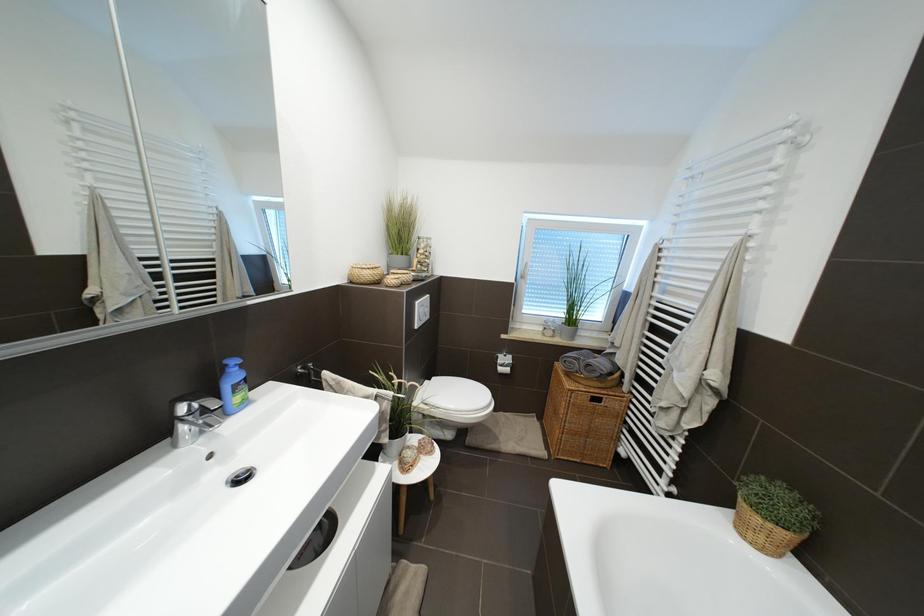
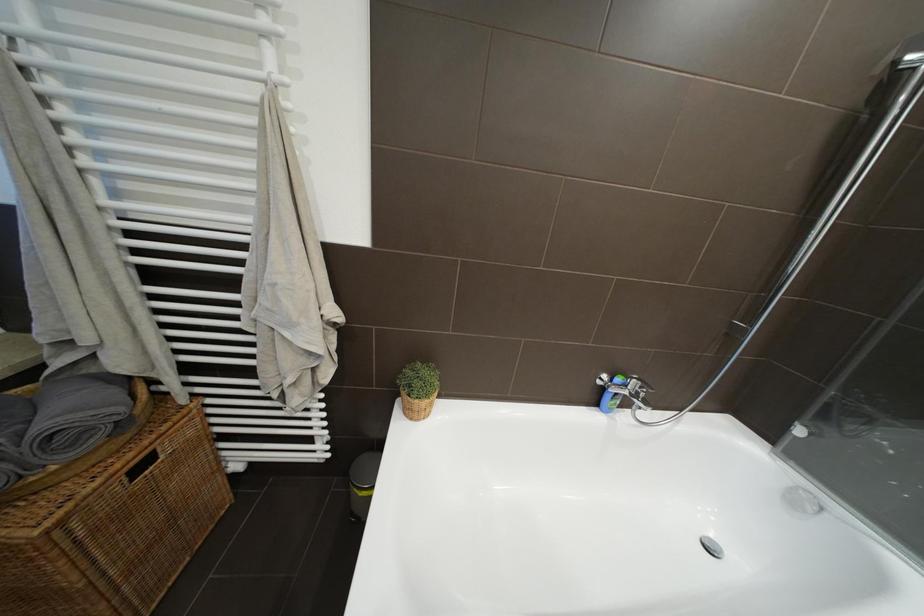
First-person continuous shooting, in which direction is the camera rotating?

The camera's rotation is toward right-down.